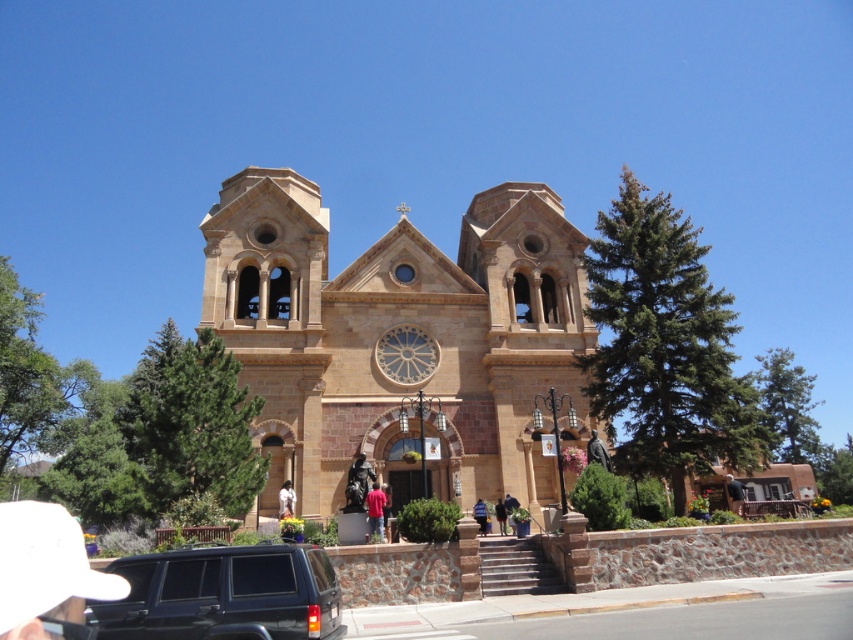
Question: Which point is farther from the camera taking this photo?

Choices:
 (A) (376, 486)
 (B) (495, 516)
 (C) (509, 512)
 (D) (485, 524)

Answer: (B)

Question: Which point is closer to the camera taking this photo?

Choices:
 (A) (498, 506)
 (B) (505, 493)

Answer: (A)

Question: Can you confirm if black matte suv at lower left is thinner than dark blue jeans at lower center?

Choices:
 (A) yes
 (B) no

Answer: (B)

Question: Which of the following is the farthest from the observer?

Choices:
 (A) red cotton shirt at center
 (B) white matte statue at center

Answer: (B)

Question: From the image, what is the correct spatial relationship of brown stone chapel at center in relation to blue denim jeans at lower center?

Choices:
 (A) left
 (B) right

Answer: (A)

Question: Is brown stone chapel at center to the left of white matte statue at center from the viewer's perspective?

Choices:
 (A) no
 (B) yes

Answer: (A)